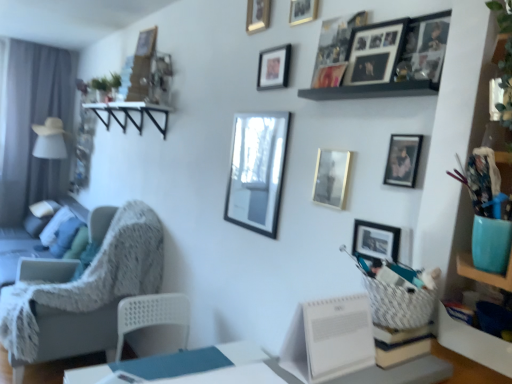
Question: Is gold metallic picture frame at upper center, the 1th picture frame from the top, positioned behind metallic gold picture frame at upper center, which is the seventh picture frame from bottom to top?

Choices:
 (A) no
 (B) yes

Answer: (B)

Question: Is gold metallic picture frame at upper center, the 1th picture frame from the top, far from metallic gold picture frame at upper center, acting as the third picture frame starting from the top?

Choices:
 (A) no
 (B) yes

Answer: (A)

Question: Does gold metallic picture frame at upper center, the 1th picture frame from the top, appear on the left side of metallic gold picture frame at upper center, which is the seventh picture frame from bottom to top?

Choices:
 (A) yes
 (B) no

Answer: (A)

Question: Is metallic gold picture frame at upper center, acting as the third picture frame starting from the top, located within gold metallic picture frame at upper center, positioned as the 9th picture frame in bottom-to-top order?

Choices:
 (A) no
 (B) yes

Answer: (A)

Question: Is gold metallic picture frame at upper center, the 1th picture frame from the top, closer to the viewer compared to metallic gold picture frame at upper center, which is the seventh picture frame from bottom to top?

Choices:
 (A) no
 (B) yes

Answer: (A)

Question: From the image's perspective, is gold metallic picture frame at upper center, the 1th picture frame from the top, on metallic gold picture frame at upper center, which is the seventh picture frame from bottom to top?

Choices:
 (A) yes
 (B) no

Answer: (A)

Question: Is black wooden shelf at upper center directly adjacent to gold metallic picture frame at upper center, positioned as the 9th picture frame in bottom-to-top order?

Choices:
 (A) yes
 (B) no

Answer: (B)

Question: Can you confirm if black wooden shelf at upper center is wider than gold metallic picture frame at upper center, positioned as the 9th picture frame in bottom-to-top order?

Choices:
 (A) yes
 (B) no

Answer: (A)

Question: Does black wooden shelf at upper center have a lesser height compared to gold metallic picture frame at upper center, the 1th picture frame from the top?

Choices:
 (A) yes
 (B) no

Answer: (A)

Question: Is black wooden shelf at upper center positioned with its back to gold metallic picture frame at upper center, the 1th picture frame from the top?

Choices:
 (A) no
 (B) yes

Answer: (A)

Question: Does black wooden shelf at upper center appear on the right side of gold metallic picture frame at upper center, positioned as the 9th picture frame in bottom-to-top order?

Choices:
 (A) no
 (B) yes

Answer: (B)

Question: From the image's perspective, is black wooden shelf at upper center located above gold metallic picture frame at upper center, positioned as the 9th picture frame in bottom-to-top order?

Choices:
 (A) no
 (B) yes

Answer: (A)

Question: Considering the relative sizes of textured gray chair at left and matte black picture frame at center, arranged as the fourth picture frame when ordered from the bottom, in the image provided, is textured gray chair at left thinner than matte black picture frame at center, arranged as the fourth picture frame when ordered from the bottom,?

Choices:
 (A) no
 (B) yes

Answer: (A)